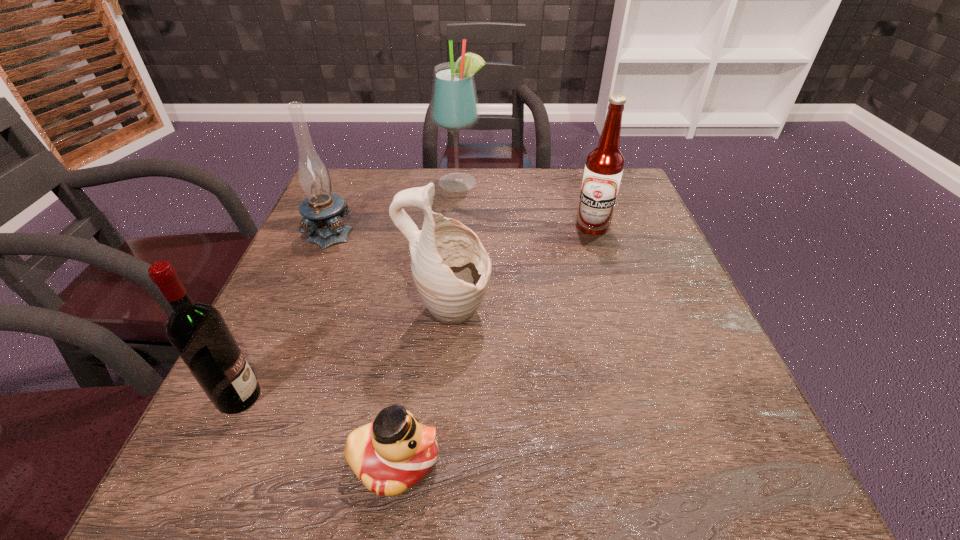
Where is `object that is at the right edge`? The image size is (960, 540). object that is at the right edge is located at coordinates (604, 165).

This screenshot has width=960, height=540. In the image, there is a desktop. Find the location of `vacant space at the far edge`. vacant space at the far edge is located at coordinates (503, 190).

The image size is (960, 540). I want to click on vacant space at the near edge of the desktop, so [601, 497].

At what (x,y) coordinates should I click in order to perform the action: click on free space at the left edge of the desktop. Please return your answer as a coordinate pair (x, y). The width and height of the screenshot is (960, 540). Looking at the image, I should click on (250, 345).

Locate an element on the screen. This screenshot has height=540, width=960. vacant space at the right edge of the desktop is located at coordinates (624, 234).

Find the location of a particular element. vacant space at the far left corner is located at coordinates [342, 182].

Identify the location of vacant space at the near right corner of the desktop. (729, 456).

At what (x,y) coordinates should I click in order to perform the action: click on vacant area that lies between the pitcher and the second nearest object. Please return your answer as a coordinate pair (x, y). Image resolution: width=960 pixels, height=540 pixels. Looking at the image, I should click on pyautogui.click(x=344, y=356).

The width and height of the screenshot is (960, 540). Identify the location of blank region between the duck and the oil lamp. (363, 346).

What are the coordinates of `empty space that is in between the leftmost alcohol and the nearest object` in the screenshot? It's located at (317, 429).